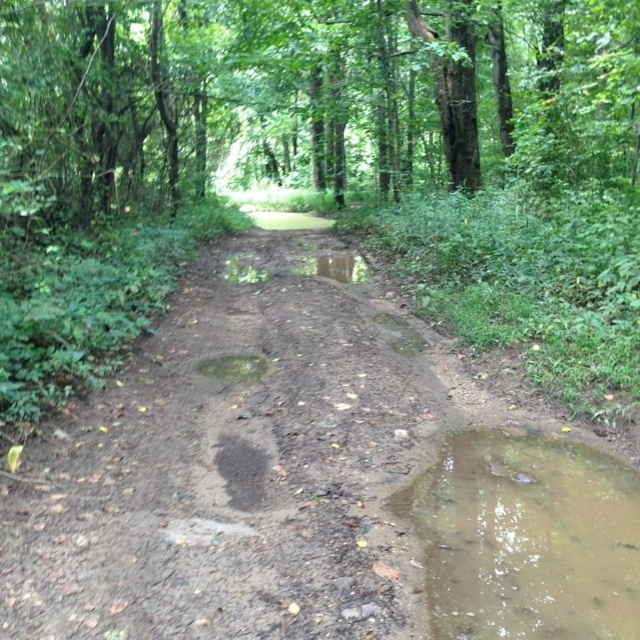
You are a hiker carrying a heavy backpack and want to cross the brown muddy dirt track at center. Considering your backpack adds 20 kg to your weight, will the track support your weight? The camera is positioned 3.35 meters away from the track. Your total weight including the backpack is 100 kg. The track can hold a maximum weight of 120 kg. Can you safely cross?

The brown muddy dirt track at center can hold a maximum weight of 120 kg. Since your total weight including the backpack is 100 kg, which is under the track maximum weight capacity, you can safely cross the brown muddy dirt track at center.

You are a hiker carrying a heavy backpack and need to cross the brown muddy dirt track at center and reach the green leafy tree at center. Given that your backpack limits your movement, can you safely navigate the 8.72 meters between them without slipping into the puddles?

The distance between the brown muddy dirt track at center and the green leafy tree at center is 8.72 meters. Since the path is muddy and has puddles, there might be slippery areas, but the distance itself is manageable. However, caution is needed to avoid slipping into the puddles while navigating the 8.72 meters between them.

You are a hiker trying to cross the forest trail. You see the brown muddy dirt track at center and the muddy wet puddle at lower right. Which path is longer and should you avoid?

The brown muddy dirt track at center is shorter than the muddy wet puddle at lower right. Therefore, the muddy wet puddle at lower right is longer and should be avoided as it might be deeper or harder to cross.